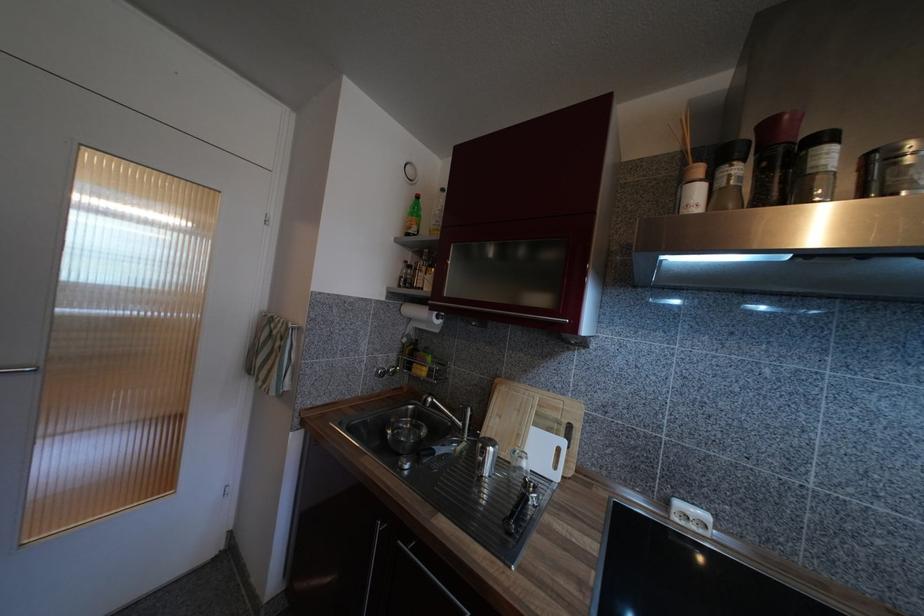
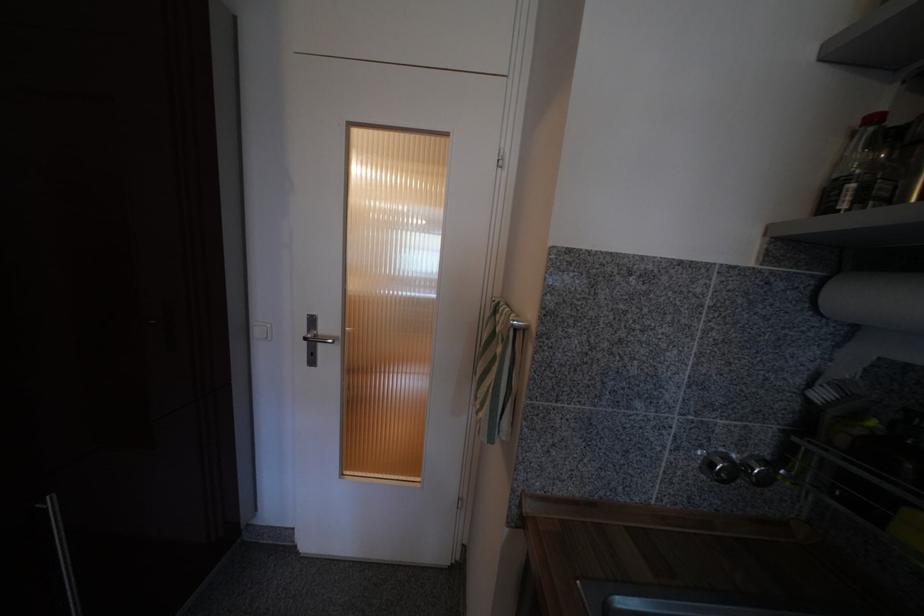
Locate, in the second image, the point that corresponds to (x=268, y=384) in the first image.

(485, 407)